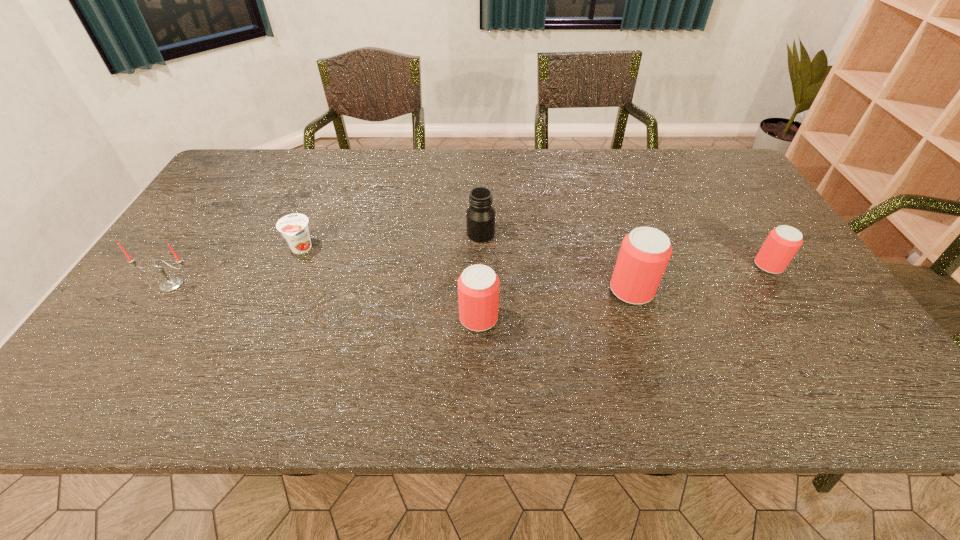
This screenshot has height=540, width=960. What are the coordinates of `the closest beer can to the shortest object` in the screenshot? It's located at (478, 286).

Where is `beer can that is the second nearest to the shortest object`? Image resolution: width=960 pixels, height=540 pixels. beer can that is the second nearest to the shortest object is located at coordinates (645, 252).

Where is `free space that satisfies the following two spatial constraints: 1. on the front side of the second shortest object; 2. on the right side of the jar`? free space that satisfies the following two spatial constraints: 1. on the front side of the second shortest object; 2. on the right side of the jar is located at coordinates (481, 266).

Find the location of a particular element. vacant area that satisfies the following two spatial constraints: 1. on the front-facing side of the tallest object; 2. on the right side of the leftmost object is located at coordinates (168, 290).